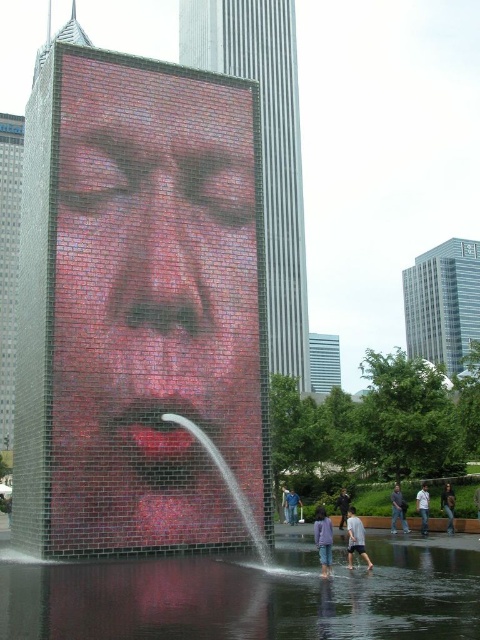
You are a fashion designer observing the urban scene. You notice the dark gray fabric pants at lower center and the dark brown leather jacket at lower right. Which clothing item has a greater width?

The dark gray fabric pants at lower center has a greater width than the dark brown leather jacket at lower right according to the description.

You are standing in the urban scene and want to approach both the dark gray fabric pants at lower center and the dark brown leather jacket at lower right. Which object should you move towards first to reach the one closer to you?

You should move towards the dark gray fabric pants at lower center first because it is closer to you than the dark brown leather jacket at lower right.